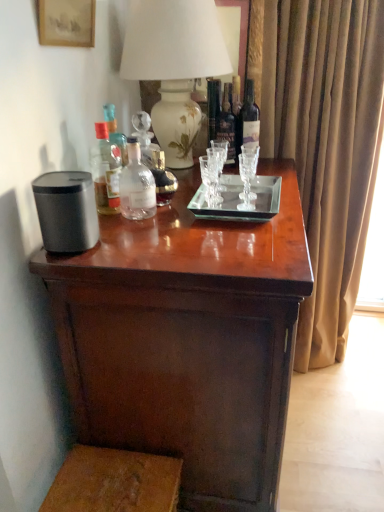
Identify the location of free space in front of clear glass bottle at center, arranged as the fourth bottle when viewed from the right. The height and width of the screenshot is (512, 384). (142, 234).